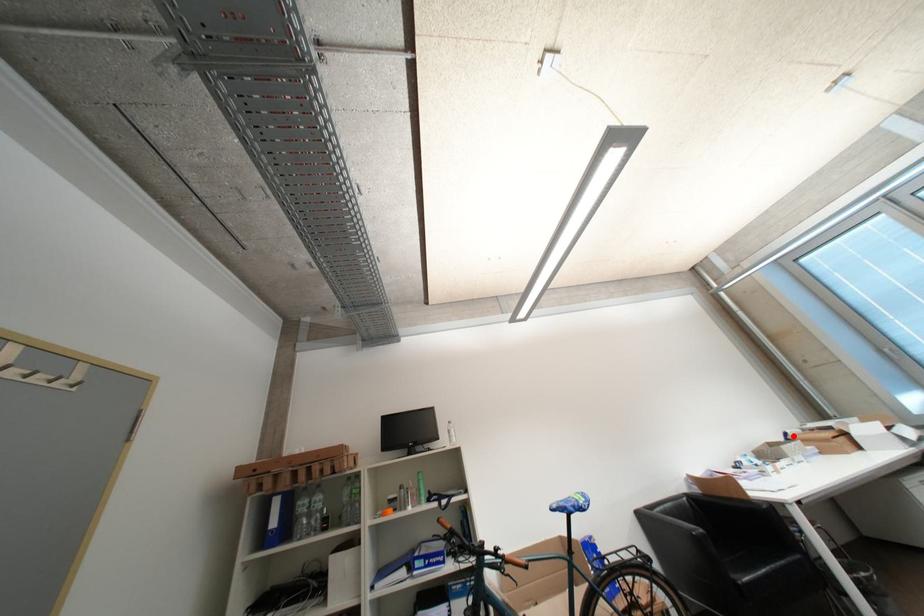
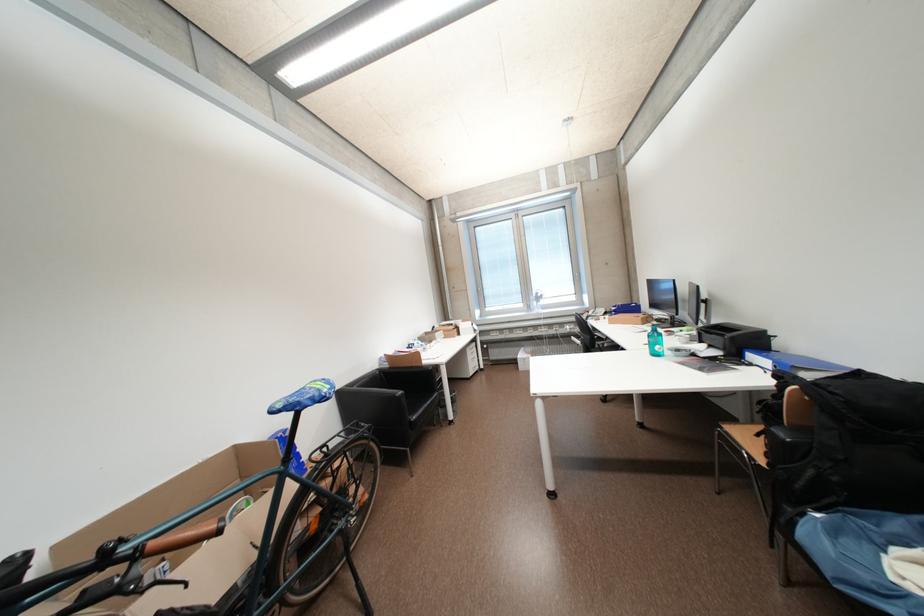
Question: I am providing you with two images of the same scene from different viewpoints. A red point is shown in image1. For the corresponding object point in image2, is it positioned nearer or farther from the camera?

Choices:
 (A) Nearer
 (B) Farther

Answer: (B)